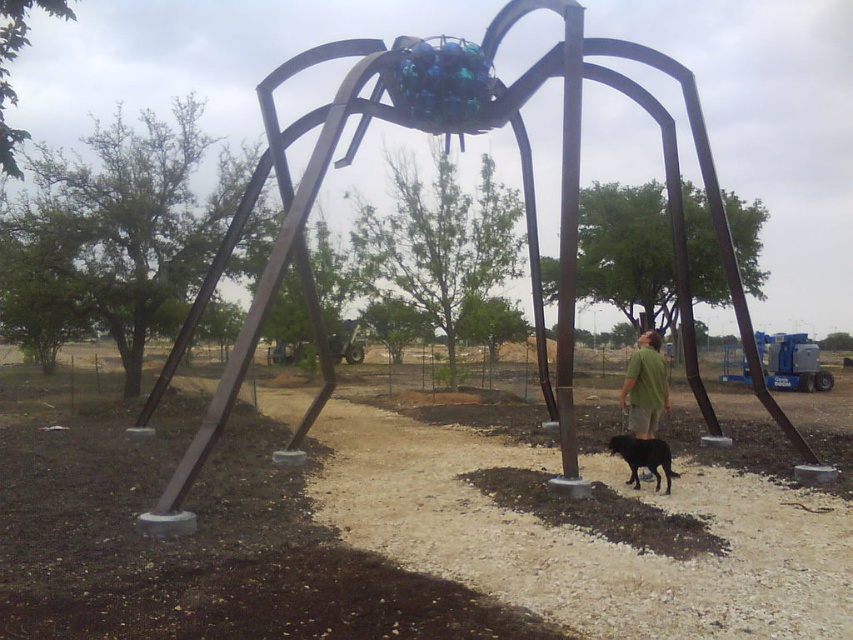
Measure the distance from brown gravel at center to green matte shirt at center.

brown gravel at center is 3.49 meters away from green matte shirt at center.

Between point (300, 547) and point (651, 413), which one is positioned in front?

Point (300, 547) is more forward.

Find the location of a particular element. The image size is (853, 640). brown gravel at center is located at coordinates (386, 536).

Can you confirm if metallic spider at center is positioned above black fur dog at lower right?

Yes, metallic spider at center is above black fur dog at lower right.

Does point (592, 51) lie behind point (646, 456)?

Yes, it is.

Find the location of a particular element. metallic spider at center is located at coordinates (447, 145).

Is brown gravel at center further to the viewer compared to metallic spider at center?

No, brown gravel at center is closer to the viewer.

Who is more forward, (575, 570) or (648, 64)?

Point (575, 570) is more forward.

Does point (326, 444) come farther from viewer compared to point (560, 428)?

Yes, point (326, 444) is farther from viewer.

The image size is (853, 640). I want to click on brown gravel at center, so click(x=386, y=536).